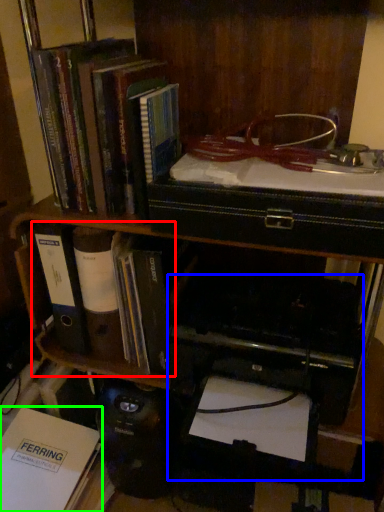
Question: Which object is the closest to the book (highlighted by a red box)? Choose among these: printer (highlighted by a blue box) or book (highlighted by a green box).

Choices:
 (A) printer
 (B) book

Answer: (A)